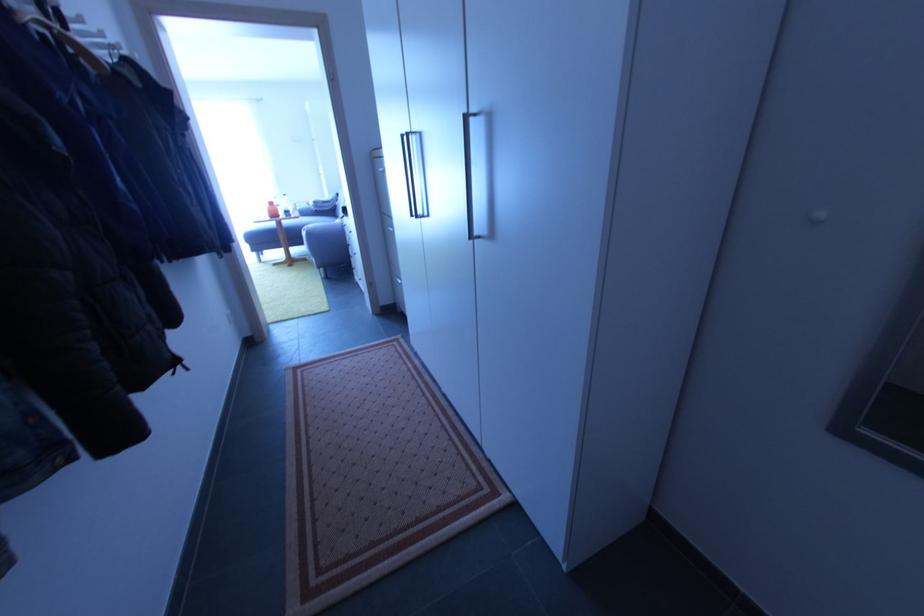
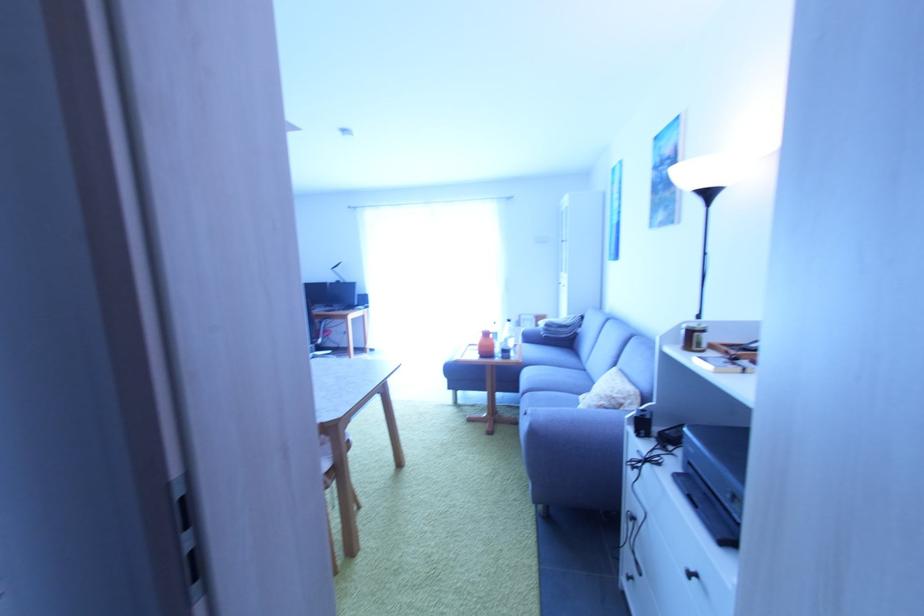
Find the pixel in the second image that matches (275,205) in the first image.

(492, 336)